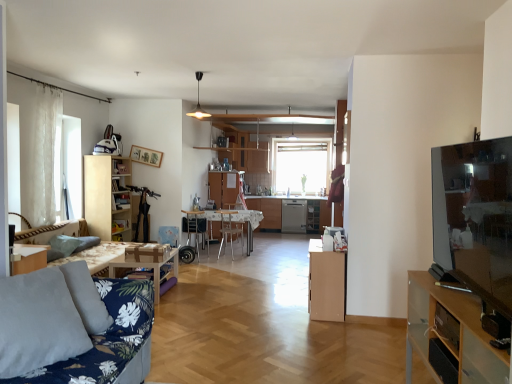
Question: Considering the relative sizes of green fabric pillow at lower left and light brown wood cabinet at center, which is the second cabinetry from right to left, in the image provided, is green fabric pillow at lower left bigger than light brown wood cabinet at center, which is the second cabinetry from right to left,?

Choices:
 (A) yes
 (B) no

Answer: (B)

Question: Considering the relative sizes of green fabric pillow at lower left and light brown wood cabinet at center, which is counted as the 2th cabinetry, starting from the front, in the image provided, is green fabric pillow at lower left taller than light brown wood cabinet at center, which is counted as the 2th cabinetry, starting from the front,?

Choices:
 (A) yes
 (B) no

Answer: (B)

Question: Considering the relative sizes of green fabric pillow at lower left and light brown wood cabinet at center, the second cabinetry viewed from the back, in the image provided, is green fabric pillow at lower left smaller than light brown wood cabinet at center, the second cabinetry viewed from the back,?

Choices:
 (A) no
 (B) yes

Answer: (B)

Question: Does green fabric pillow at lower left appear on the right side of light brown wood cabinet at center, which is the second cabinetry from right to left?

Choices:
 (A) no
 (B) yes

Answer: (A)

Question: From the image's perspective, is green fabric pillow at lower left beneath light brown wood cabinet at center, the second cabinetry viewed from the left?

Choices:
 (A) no
 (B) yes

Answer: (A)

Question: Considering their positions, is wooden picture frame at upper center located in front of or behind white glossy table at center, positioned as the first table in right-to-left order?

Choices:
 (A) behind
 (B) front

Answer: (B)

Question: Considering the positions of wooden picture frame at upper center and white glossy table at center, which appears as the 2th table when viewed from the front, in the image, is wooden picture frame at upper center taller or shorter than white glossy table at center, which appears as the 2th table when viewed from the front,?

Choices:
 (A) tall
 (B) short

Answer: (B)

Question: Based on their positions, is wooden picture frame at upper center located to the left or right of white glossy table at center, which appears as the 2th table when viewed from the front?

Choices:
 (A) left
 (B) right

Answer: (A)

Question: From the image's perspective, is wooden picture frame at upper center positioned above or below white glossy table at center, positioned as the first table in right-to-left order?

Choices:
 (A) below
 (B) above

Answer: (B)

Question: Would you say metallic silver chair at center, the first chair positioned from the right, is inside or outside green fabric pillow at lower left?

Choices:
 (A) inside
 (B) outside

Answer: (B)

Question: Is metallic silver chair at center, which is the 2th chair from left to right, wider or thinner than green fabric pillow at lower left?

Choices:
 (A) thin
 (B) wide

Answer: (B)

Question: From a real-world perspective, relative to green fabric pillow at lower left, is metallic silver chair at center, the first chair positioned from the right, vertically above or below?

Choices:
 (A) below
 (B) above

Answer: (A)

Question: In terms of height, does metallic silver chair at center, which is the 2th chair from left to right, look taller or shorter compared to green fabric pillow at lower left?

Choices:
 (A) tall
 (B) short

Answer: (A)

Question: Which is correct: white glossy table at center, the second table from the left, is inside wooden chair at center, the 1th chair positioned from the left, or outside of it?

Choices:
 (A) inside
 (B) outside

Answer: (B)

Question: Considering the positions of white glossy table at center, marked as the first table in a back-to-front arrangement, and wooden chair at center, the 1th chair positioned from the left, in the image, is white glossy table at center, marked as the first table in a back-to-front arrangement, bigger or smaller than wooden chair at center, the 1th chair positioned from the left,?

Choices:
 (A) small
 (B) big

Answer: (B)